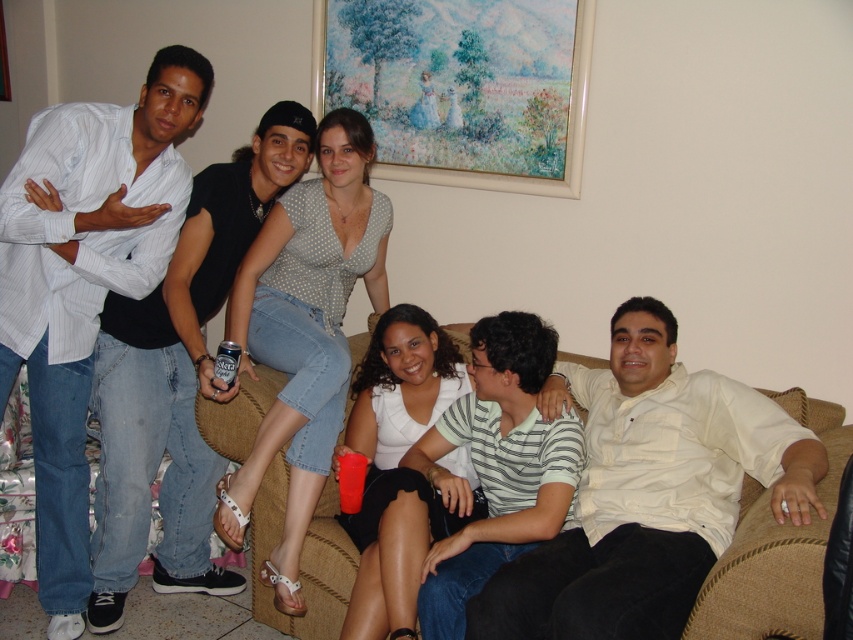
You are a painter standing 2 feet away from the striped cotton polo shirt at center. Can you reach the pastel oil painting at upper center without moving your position?

The distance between the pastel oil painting at upper center and the striped cotton polo shirt at center is 3.36 feet. Since you are 2 feet away from the striped cotton polo shirt at center, the total distance to the painting would be 2 feet plus 3.36 feet, totaling 5.36 feet. Therefore, you cannot reach the pastel oil painting at upper center without moving your position.